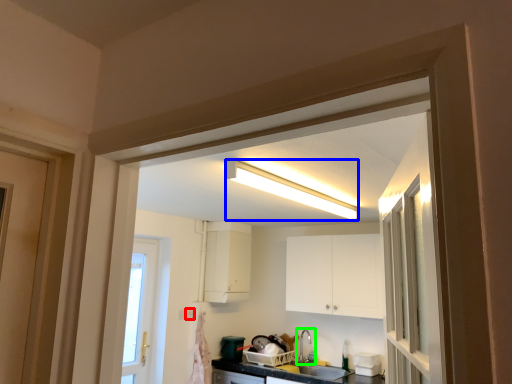
Question: Estimate the real-world distances between objects in this image. Which object is farther from electric outlet (highlighted by a red box), light fixture (highlighted by a blue box) or tap (highlighted by a green box)?

Choices:
 (A) light fixture
 (B) tap

Answer: (A)